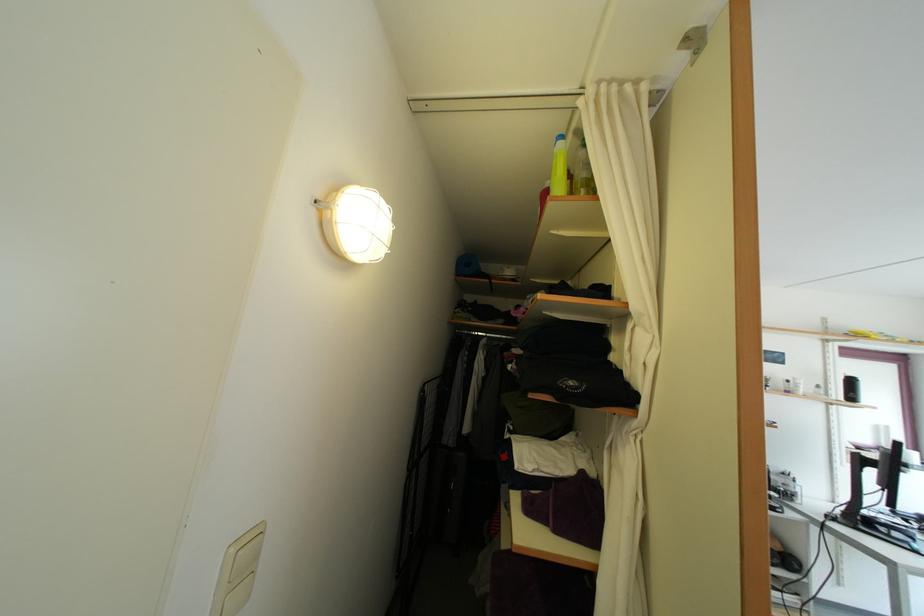
What do you see at coordinates (237, 572) in the screenshot? I see `a white light switch` at bounding box center [237, 572].